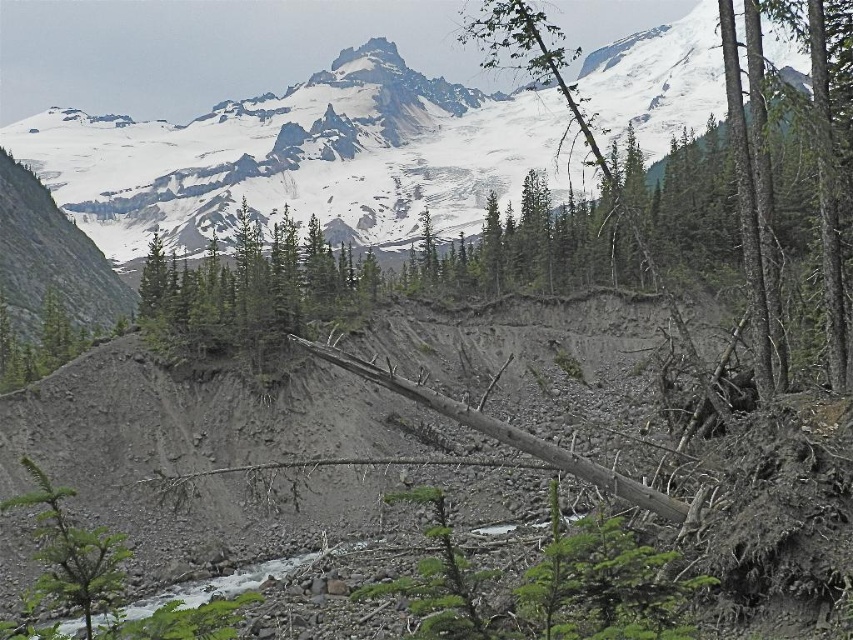
You are a hiker planning to take a photo of the snowy granite mountain at upper center and the green matte tree at center. Which object should you focus on first if you want both to be in sharp focus?

You should focus on the snowy granite mountain at upper center first because it is larger than the green matte tree at center, so focusing on the larger object ensures both will be in focus.

Looking at the snowy granite mountain at upper center and the green leafy tree at upper center in the mountainous landscape, which one is positioned more to the left side of the image?

The snowy granite mountain at upper center is positioned to the left of the green leafy tree at upper center, so it is more to the left side of the image.